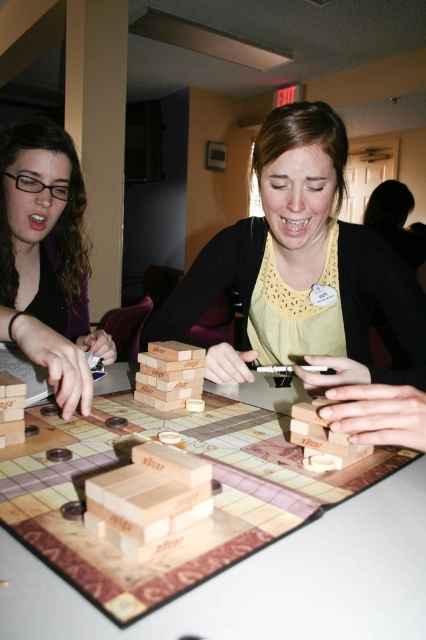
Question: Where is wooden game board at center located in relation to matte black hair at left in the image?

Choices:
 (A) right
 (B) left

Answer: (A)

Question: Which point is closer to the camera?

Choices:
 (A) (356, 604)
 (B) (423, 296)

Answer: (A)

Question: Is the position of wooden game board at center more distant than that of matte wood blocks at center?

Choices:
 (A) yes
 (B) no

Answer: (B)

Question: Which object is the closest to the matte black hair at left?

Choices:
 (A) matte wood blocks at center
 (B) wooden game board at center

Answer: (A)

Question: Estimate the real-world distances between objects in this image. Which object is farther from the matte black hair at left?

Choices:
 (A) wooden game board at center
 (B) matte wood blocks at center

Answer: (A)

Question: Is wooden game board at center below matte wood blocks at center?

Choices:
 (A) yes
 (B) no

Answer: (A)